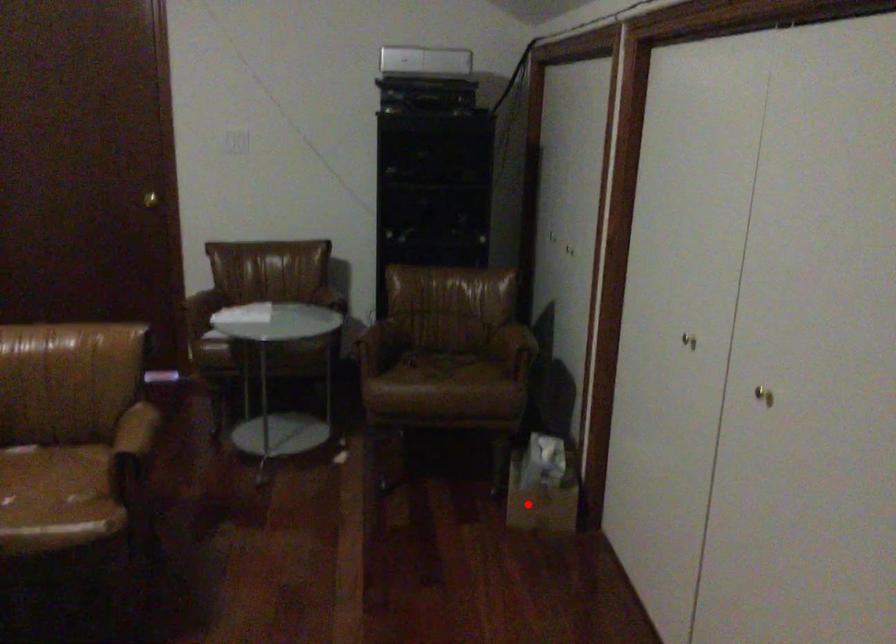
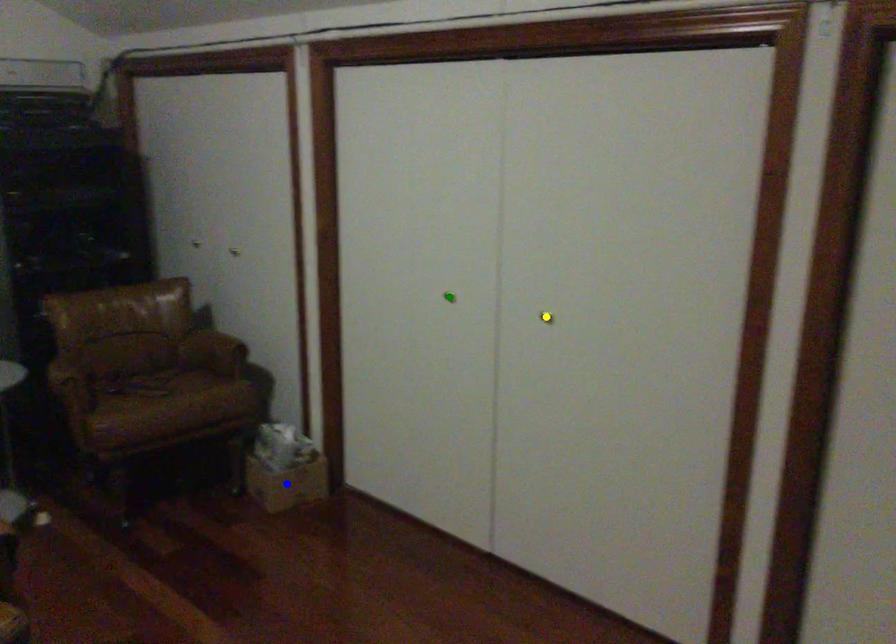
Question: I am providing you with two images of the same scene from different viewpoints. A red point is marked on the first image. You are given multiple points on the second image. In image 2, which mark is for the same physical point as the one in image 1?

Choices:
 (A) green point
 (B) blue point
 (C) yellow point

Answer: (B)